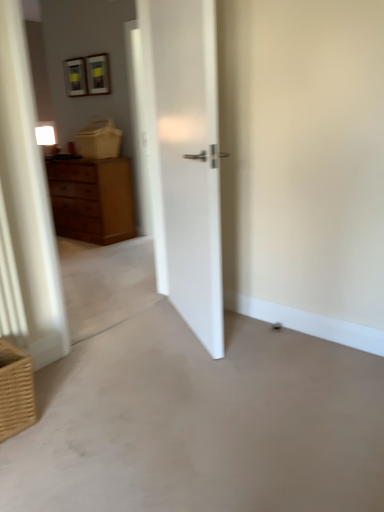
Question: Is wooden chest of drawers at left surrounded by smooth concrete floor at center?

Choices:
 (A) no
 (B) yes

Answer: (A)

Question: Is smooth concrete floor at center oriented towards wooden chest of drawers at left?

Choices:
 (A) no
 (B) yes

Answer: (A)

Question: Would you say smooth concrete floor at center is a long distance from wooden chest of drawers at left?

Choices:
 (A) yes
 (B) no

Answer: (A)

Question: Considering the relative sizes of smooth concrete floor at center and wooden chest of drawers at left in the image provided, is smooth concrete floor at center taller than wooden chest of drawers at left?

Choices:
 (A) yes
 (B) no

Answer: (B)

Question: From a real-world perspective, is smooth concrete floor at center located higher than wooden chest of drawers at left?

Choices:
 (A) no
 (B) yes

Answer: (A)

Question: Is point (190, 483) positioned closer to the camera than point (82, 187)?

Choices:
 (A) farther
 (B) closer

Answer: (B)

Question: From a real-world perspective, is smooth concrete floor at center physically located above or below wooden chest of drawers at left?

Choices:
 (A) below
 (B) above

Answer: (A)

Question: Is smooth concrete floor at center wider or thinner than wooden chest of drawers at left?

Choices:
 (A) wide
 (B) thin

Answer: (A)

Question: Is smooth concrete floor at center situated inside wooden chest of drawers at left or outside?

Choices:
 (A) outside
 (B) inside

Answer: (A)

Question: From the image's perspective, is wooden chest of drawers at left above or below smooth concrete floor at center?

Choices:
 (A) above
 (B) below

Answer: (A)

Question: Looking at the image, does wooden chest of drawers at left seem bigger or smaller compared to smooth concrete floor at center?

Choices:
 (A) small
 (B) big

Answer: (B)

Question: From a real-world perspective, relative to smooth concrete floor at center, is wooden chest of drawers at left vertically above or below?

Choices:
 (A) below
 (B) above

Answer: (B)

Question: In terms of width, does wooden chest of drawers at left look wider or thinner when compared to smooth concrete floor at center?

Choices:
 (A) thin
 (B) wide

Answer: (A)

Question: Is wooden chest of drawers at left inside the boundaries of brown woven basket at lower left, or outside?

Choices:
 (A) outside
 (B) inside

Answer: (A)

Question: Relative to brown woven basket at lower left, is wooden chest of drawers at left in front or behind?

Choices:
 (A) behind
 (B) front

Answer: (A)